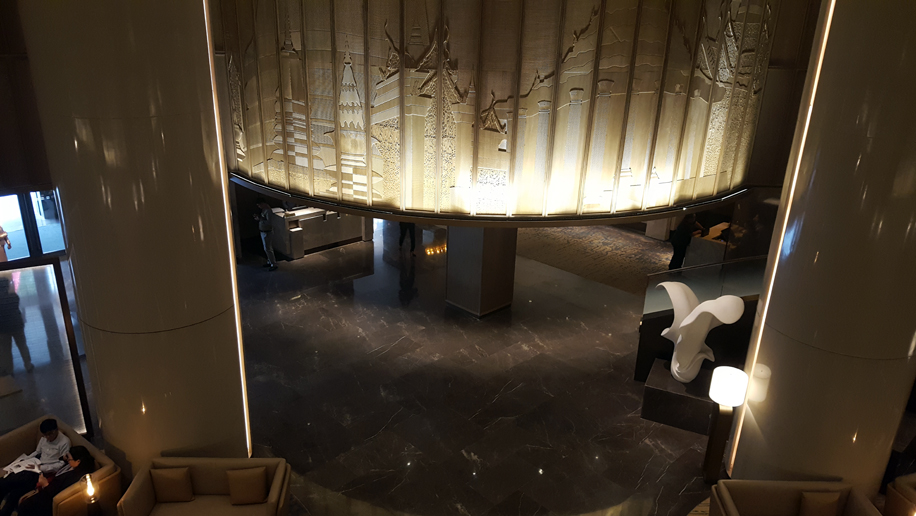
This screenshot has width=916, height=516. Identify the location of sculpture. (690, 349).